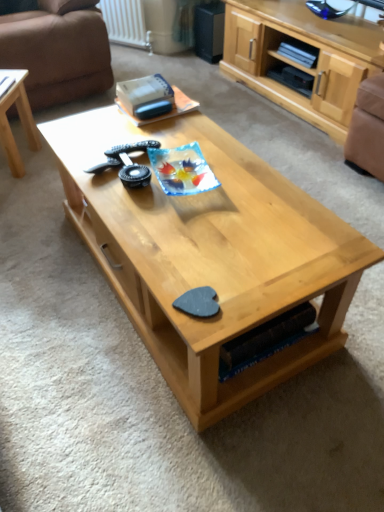
Question: Is light wood/texture coffee table at left, which is the second coffee table from right to left, bigger than natural wood coffee table at center, the 1th coffee table viewed from the right?

Choices:
 (A) yes
 (B) no

Answer: (B)

Question: Is light wood/texture coffee table at left, which is the 1th coffee table in left-to-right order, facing towards natural wood coffee table at center, which is the 2th coffee table in left-to-right order?

Choices:
 (A) yes
 (B) no

Answer: (B)

Question: Is light wood/texture coffee table at left, which is the 1th coffee table in left-to-right order, surrounding natural wood coffee table at center, which is the 2th coffee table in left-to-right order?

Choices:
 (A) yes
 (B) no

Answer: (B)

Question: Considering the relative sizes of light wood/texture coffee table at left, which is the second coffee table from right to left, and natural wood coffee table at center, the 1th coffee table viewed from the right, in the image provided, is light wood/texture coffee table at left, which is the second coffee table from right to left, wider than natural wood coffee table at center, the 1th coffee table viewed from the right,?

Choices:
 (A) no
 (B) yes

Answer: (A)

Question: Is light wood/texture coffee table at left, which is the second coffee table from right to left, taller than natural wood coffee table at center, the 1th coffee table viewed from the right?

Choices:
 (A) yes
 (B) no

Answer: (B)

Question: Is light wood/texture coffee table at left, which is the second coffee table from right to left, positioned with its back to natural wood coffee table at center, which is the 2th coffee table in left-to-right order?

Choices:
 (A) yes
 (B) no

Answer: (B)

Question: Can you confirm if brown fabric armchair at right is positioned to the left of brown leather couch at upper left?

Choices:
 (A) no
 (B) yes

Answer: (A)

Question: From the image's perspective, is brown fabric armchair at right on brown leather couch at upper left?

Choices:
 (A) yes
 (B) no

Answer: (B)

Question: Is brown fabric armchair at right oriented towards brown leather couch at upper left?

Choices:
 (A) no
 (B) yes

Answer: (A)

Question: From the image's perspective, is brown fabric armchair at right below brown leather couch at upper left?

Choices:
 (A) yes
 (B) no

Answer: (A)

Question: Does brown fabric armchair at right lie in front of brown leather couch at upper left?

Choices:
 (A) yes
 (B) no

Answer: (A)

Question: Is brown fabric armchair at right looking in the opposite direction of brown leather couch at upper left?

Choices:
 (A) no
 (B) yes

Answer: (A)

Question: Can you confirm if natural wood coffee table at center, which is the 2th coffee table in left-to-right order, is bigger than brown fabric armchair at right?

Choices:
 (A) no
 (B) yes

Answer: (B)